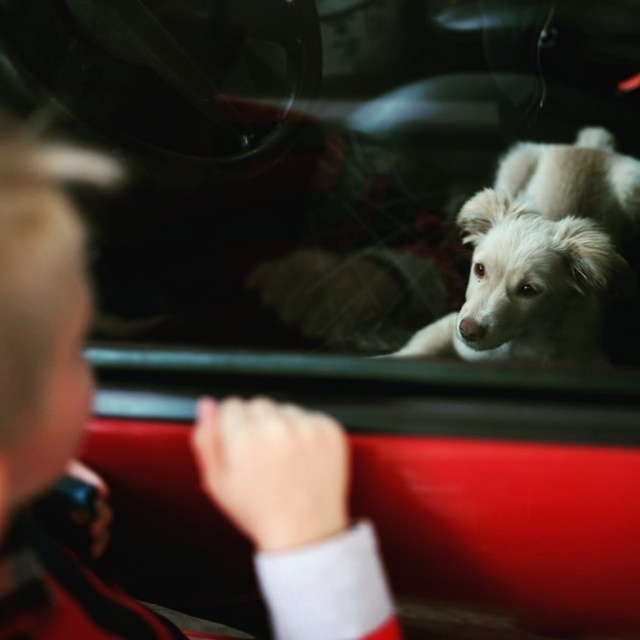
Who is more forward, (198, 403) or (454, 339)?

Point (198, 403) is in front.

In the scene shown: Is blonde hair at upper left closer to the viewer compared to white fluffy dog at center?

Yes, blonde hair at upper left is closer to the viewer.

Between point (36, 406) and point (428, 337), which one is positioned in front?

Point (36, 406) is more forward.

Locate an element on the screen. Image resolution: width=640 pixels, height=640 pixels. blonde hair at upper left is located at coordinates (49, 413).